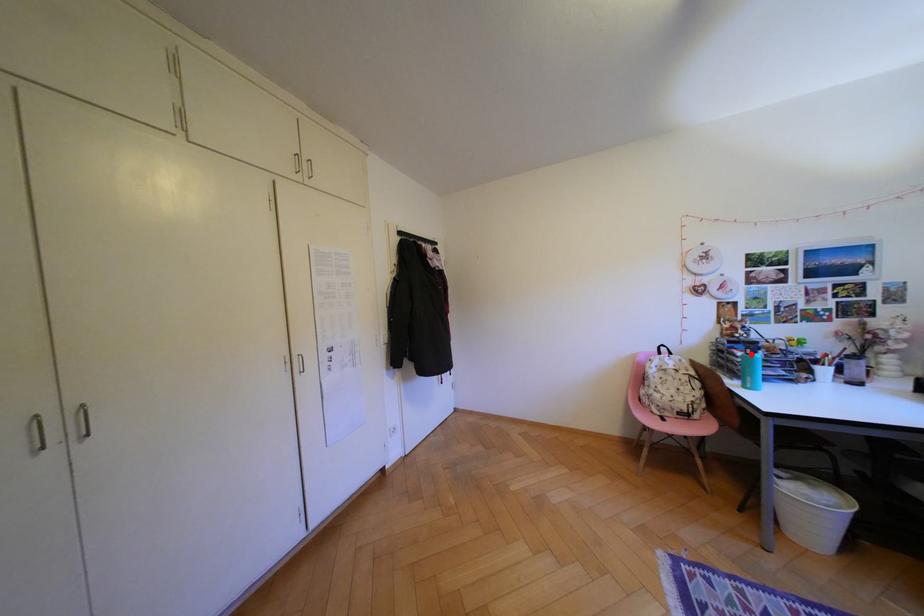
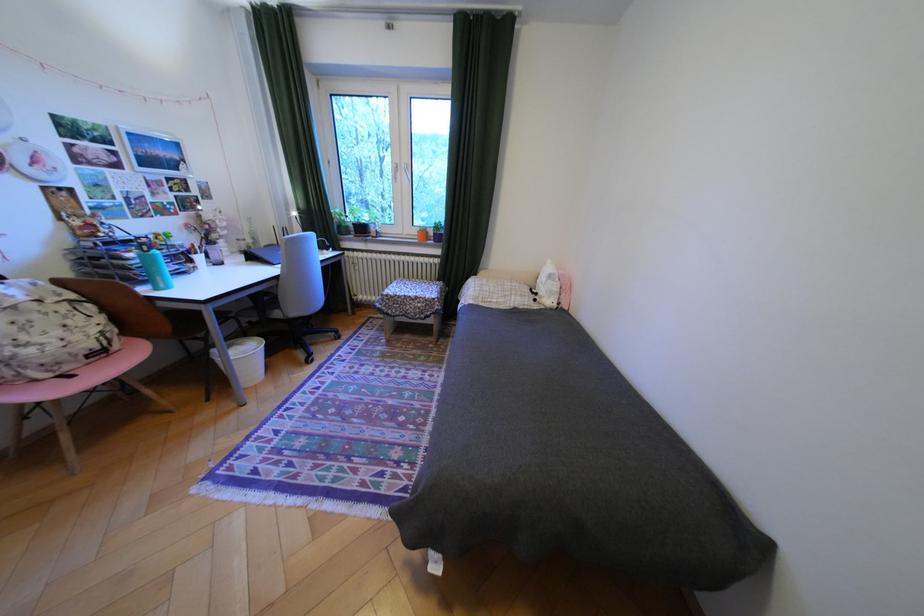
Locate, in the second image, the point that corresponds to the highlighted location in the first image.

(140, 254)